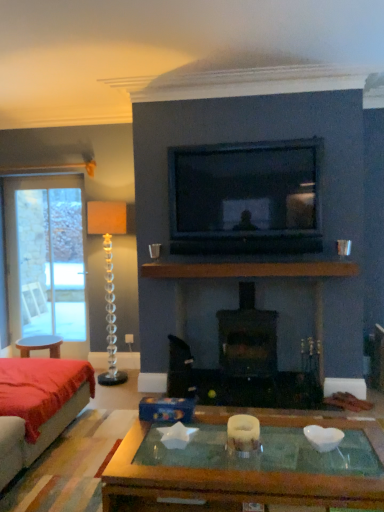
Question: In terms of width, does brown wooden mantle at center look wider or thinner when compared to silver metallic cup at center?

Choices:
 (A) thin
 (B) wide

Answer: (B)

Question: Based on their positions, is brown wooden mantle at center located to the left or right of silver metallic cup at center?

Choices:
 (A) left
 (B) right

Answer: (B)

Question: Which object is positioned farthest from the white frosted glass candle holder at center, marked as the first candle holder in a front-to-back arrangement?

Choices:
 (A) clear glass candle holder at left, arranged as the first candle holder when viewed from the top
 (B) brown wooden mantle at center
 (C) black matte fireplace at center
 (D) matte black television at upper center
 (E) clear glass screen door at left

Answer: (E)

Question: Which of these objects is positioned closest to the brown wooden mantle at center?

Choices:
 (A) matte black television at upper center
 (B) clear glass screen door at left
 (C) velvet red couch at lower left
 (D) white frosted glass candle holder at center, which is the second candle holder in back-to-front order
 (E) silver metallic cup at center

Answer: (A)